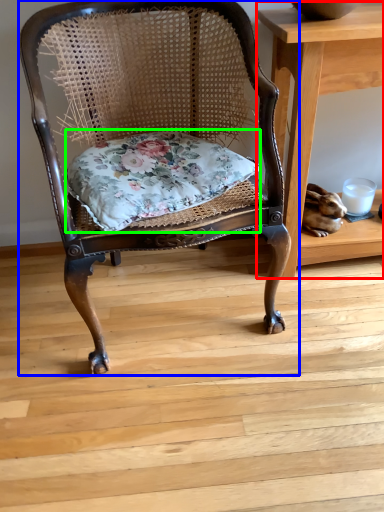
Question: Estimate the real-world distances between objects in this image. Which object is closer to table (highlighted by a red box), chair (highlighted by a blue box) or pillow (highlighted by a green box)?

Choices:
 (A) chair
 (B) pillow

Answer: (A)